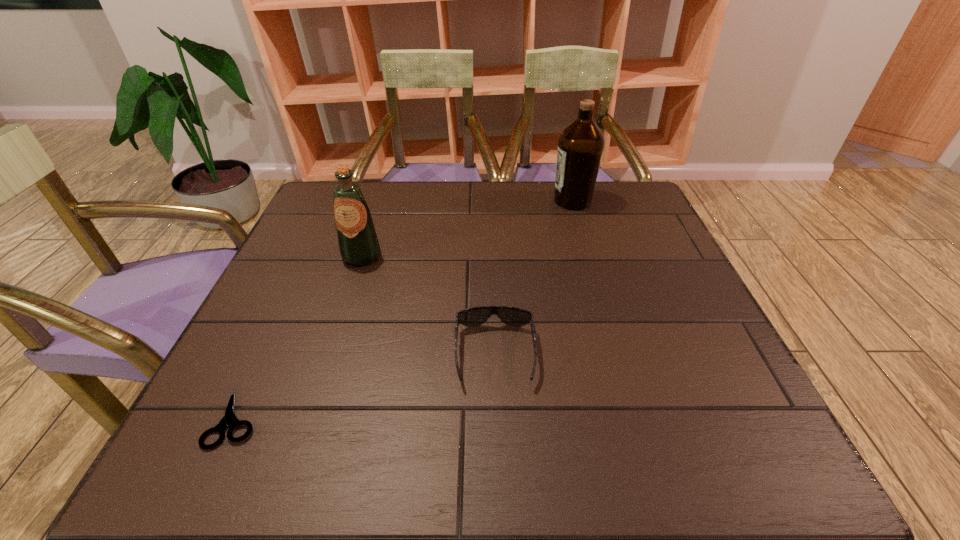
Find the location of a particular element. This screenshot has height=540, width=960. vacant point located on the label of the tallest object is located at coordinates (479, 201).

Locate an element on the screen. vacant space located 0.080m on the front-facing side of the nearer olive oil is located at coordinates [x=349, y=292].

At what (x,y) coordinates should I click in order to perform the action: click on free point located on the front-facing side of the sunglasses. Please return your answer as a coordinate pair (x, y). This screenshot has width=960, height=540. Looking at the image, I should click on (497, 425).

Where is `blank space located 0.250m on the right of the leftmost object`? This screenshot has height=540, width=960. blank space located 0.250m on the right of the leftmost object is located at coordinates (406, 417).

Where is `object present at the far edge`? The height and width of the screenshot is (540, 960). object present at the far edge is located at coordinates (581, 144).

In order to click on object at the near edge in this screenshot , I will do `click(229, 420)`.

The width and height of the screenshot is (960, 540). In order to click on olive oil located at the left edge in this screenshot , I will do tap(357, 239).

Where is `shears present at the left edge`? This screenshot has height=540, width=960. shears present at the left edge is located at coordinates (229, 420).

This screenshot has height=540, width=960. I want to click on object that is at the right edge, so click(581, 144).

Find the location of a particular element. This screenshot has height=540, width=960. object at the near left corner is located at coordinates (229, 420).